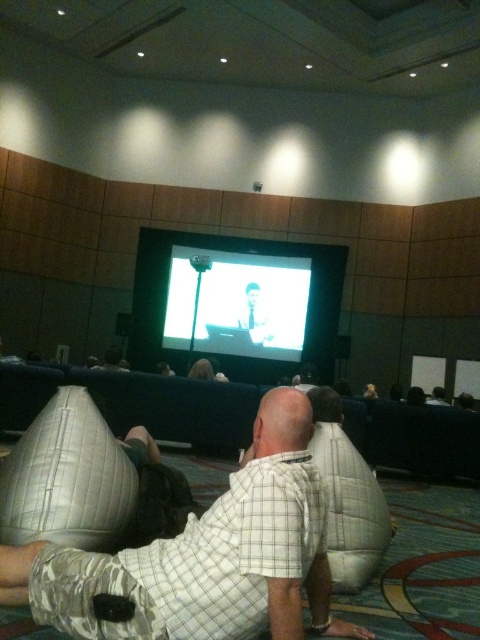
You are an event planner setting up a presentation. You have a matte white screen at center and a light brown suit at center on stage. Which object should you adjust first if you want to ensure both are visible to the audience equally?

The matte white screen at center is bigger than the light brown suit at center, so you should adjust the positioning or size of the light brown suit at center to match the visibility of the matte white screen at center.

You are attending a presentation in this room and notice two people sitting in the front row. One is wearing a white checkered shirt at center and the other is in a light brown suit at center. From your perspective at the back of the room, which person is sitting to the right?

The light brown suit at center is sitting to the right because the white checkered shirt at center is positioned on the left side of it.